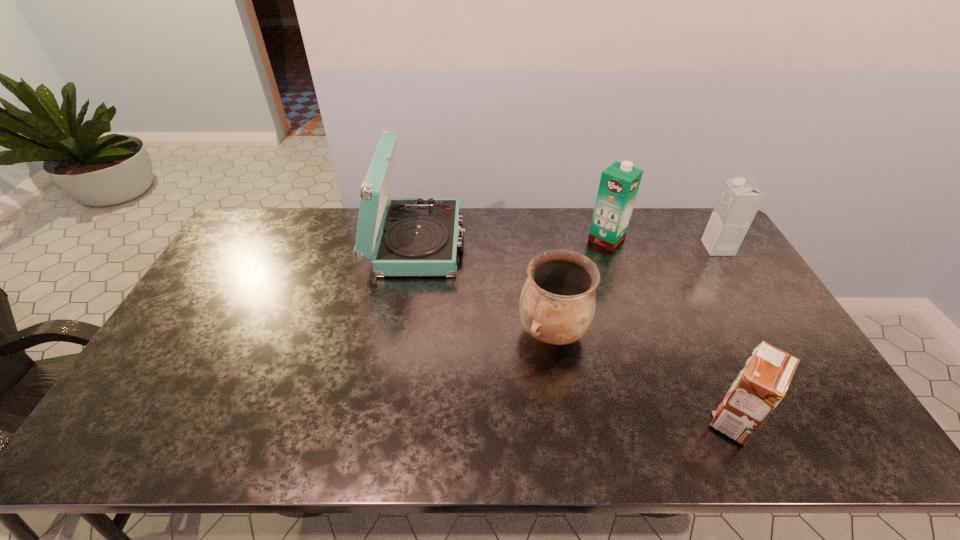
You are a GUI agent. You are given a task and a screenshot of the screen. Output one action in this format:
    pyautogui.click(x=<x>, y=<y>)
    Task: Click on the leftmost object
    This screenshot has width=960, height=540.
    Given the screenshot: What is the action you would take?
    pyautogui.click(x=419, y=236)

The image size is (960, 540). Identify the location of the third object from left to right. (619, 183).

The image size is (960, 540). Find the location of `the rightmost carton`. the rightmost carton is located at coordinates (740, 198).

Locate an element on the screen. urn is located at coordinates (557, 303).

This screenshot has width=960, height=540. In order to click on the second nearest object in this screenshot , I will do `click(557, 303)`.

Identify the location of the nearest carton. (763, 382).

The height and width of the screenshot is (540, 960). Identify the location of the second carton from right to left. point(763,382).

Where is `vacant space located on the face side of the leftmost object`? The width and height of the screenshot is (960, 540). vacant space located on the face side of the leftmost object is located at coordinates (574, 243).

Find the location of a particular element. The width and height of the screenshot is (960, 540). vacant space located on the front of the leftmost carton is located at coordinates (628, 302).

I want to click on vacant space located 0.270m on the front label of the rightmost object, so click(627, 248).